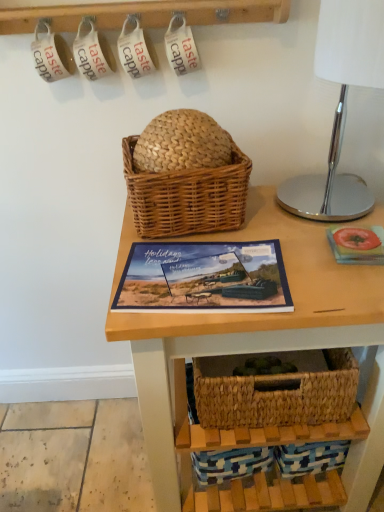
What is the approximate width of woven brown picnic basket at center?

woven brown picnic basket at center is 9.98 inches wide.

Locate an element on the screen. woven wood table at center is located at coordinates (244, 321).

Describe the element at coordinates (204, 278) in the screenshot. I see `matte blue book at center` at that location.

Image resolution: width=384 pixels, height=512 pixels. Find the location of `polished chrome table lamp at right`. polished chrome table lamp at right is located at coordinates (340, 106).

Identify the location of woven brown picnic basket at center. (187, 196).

Are woven brown picnic basket at center and polished chrome table lamp at right far apart?

No.

From the image's perspective, is woven brown picnic basket at center beneath polished chrome table lamp at right?

Yes, from the image's perspective, woven brown picnic basket at center is below polished chrome table lamp at right.

Considering the relative positions of woven brown picnic basket at center and polished chrome table lamp at right in the image provided, is woven brown picnic basket at center to the left or to the right of polished chrome table lamp at right?

Clearly, woven brown picnic basket at center is on the left of polished chrome table lamp at right in the image.

Considering their positions, is woven brown picnic basket at center located in front of or behind polished chrome table lamp at right?

woven brown picnic basket at center is behind polished chrome table lamp at right.

Would you say woven brown picnic basket at center is a long distance from matte blue book at center?

They are positioned close to each other.

Is woven brown picnic basket at center completely or partially outside of matte blue book at center?

woven brown picnic basket at center lies outside matte blue book at center's area.

Considering the relative sizes of woven brown picnic basket at center and matte blue book at center in the image provided, is woven brown picnic basket at center bigger than matte blue book at center?

Correct, woven brown picnic basket at center is larger in size than matte blue book at center.

Is woven brown picnic basket at center at the left side of matte blue book at center?

Correct, you'll find woven brown picnic basket at center to the left of matte blue book at center.

Is woven wood table at center directly adjacent to matte blue book at center?

No, woven wood table at center is not touching matte blue book at center.

From a real-world perspective, who is located lower, woven wood table at center or matte blue book at center?

woven wood table at center.

Considering the sizes of objects woven wood table at center and matte blue book at center in the image provided, who is wider, woven wood table at center or matte blue book at center?

Wider between the two is woven wood table at center.

Considering the sizes of objects polished chrome table lamp at right and woven brown picnic basket at center in the image provided, who is shorter, polished chrome table lamp at right or woven brown picnic basket at center?

With less height is woven brown picnic basket at center.

Looking at this image, is woven brown picnic basket at center at the back of polished chrome table lamp at right?

That's not correct — polished chrome table lamp at right is not looking away from woven brown picnic basket at center.

From a real-world perspective, is polished chrome table lamp at right located beneath woven brown picnic basket at center?

No.

Where is `table lamp lying above the woven brown picnic basket at center (from the image's perspective)`? table lamp lying above the woven brown picnic basket at center (from the image's perspective) is located at coordinates (340, 106).

Consider the image. Considering the relative positions of matte blue book at center and woven wood table at center in the image provided, is matte blue book at center to the right of woven wood table at center from the viewer's perspective?

No, matte blue book at center is not to the right of woven wood table at center.

Is woven wood table at center at the back of matte blue book at center?

Yes, matte blue book at center is positioned with its back facing woven wood table at center.

From a real-world perspective, which object stands above the other?

matte blue book at center is physically above.

Does matte blue book at center have a smaller size compared to woven wood table at center?

Yes.

Where is `table that appears below the polished chrome table lamp at right (from the image's perspective)`? This screenshot has width=384, height=512. table that appears below the polished chrome table lamp at right (from the image's perspective) is located at coordinates (244, 321).

Is woven wood table at center placed right next to polished chrome table lamp at right?

woven wood table at center is not next to polished chrome table lamp at right, and they're not touching.

Is point (141, 335) closer or farther from the camera than point (279, 188)?

Point (141, 335) is closer to the camera than point (279, 188).

Does woven brown picnic basket at center appear on the left side of woven wood table at center?

Indeed, woven brown picnic basket at center is positioned on the left side of woven wood table at center.

Is woven brown picnic basket at center oriented away from woven wood table at center?

That's not correct — woven brown picnic basket at center is not looking away from woven wood table at center.

Looking at the image, does woven brown picnic basket at center seem bigger or smaller compared to woven wood table at center?

Clearly, woven brown picnic basket at center is smaller in size than woven wood table at center.

How much distance is there between woven brown picnic basket at center and woven wood table at center?

woven brown picnic basket at center and woven wood table at center are 8.52 inches apart.

Find the location of a particular element. table lamp that is in front of the woven brown picnic basket at center is located at coordinates (340, 106).

What are the coordinates of `picnic basket that appears above the matte blue book at center (from the image's perspective)` in the screenshot? It's located at (187, 196).

Considering their positions, is matte blue book at center positioned closer to polished chrome table lamp at right than woven brown picnic basket at center?

The object closer to polished chrome table lamp at right is woven brown picnic basket at center.

Estimate the real-world distances between objects in this image. Which object is further from woven brown picnic basket at center, woven wood table at center or polished chrome table lamp at right?

polished chrome table lamp at right lies further to woven brown picnic basket at center than the other object.

Estimate the real-world distances between objects in this image. Which object is closer to matte blue book at center, polished chrome table lamp at right or woven brown picnic basket at center?

woven brown picnic basket at center is closer to matte blue book at center.

Looking at the image, which one is located closer to matte blue book at center, woven wood table at center or woven brown picnic basket at center?

woven brown picnic basket at center lies closer to matte blue book at center than the other object.

When comparing their distances from woven brown picnic basket at center, does polished chrome table lamp at right or woven wood table at center seem further?

Among the two, polished chrome table lamp at right is located further to woven brown picnic basket at center.

Looking at this image, which object lies further to the anchor point woven wood table at center, polished chrome table lamp at right or woven brown picnic basket at center?

polished chrome table lamp at right.

Looking at the image, which one is located further to woven wood table at center, matte blue book at center or polished chrome table lamp at right?

polished chrome table lamp at right is further to woven wood table at center.

Considering their positions, is woven wood table at center positioned further to woven brown picnic basket at center than matte blue book at center?

woven wood table at center lies further to woven brown picnic basket at center than the other object.

Find the location of a particular element. Image resolution: width=384 pixels, height=512 pixels. picture frame between woven brown picnic basket at center and polished chrome table lamp at right in the horizontal direction is located at coordinates (204, 278).

The height and width of the screenshot is (512, 384). In order to click on picnic basket between polished chrome table lamp at right and woven wood table at center in the vertical direction in this screenshot , I will do `click(187, 196)`.

Find the location of a particular element. Image resolution: width=384 pixels, height=512 pixels. picture frame between woven brown picnic basket at center and woven wood table at center from top to bottom is located at coordinates (204, 278).

The width and height of the screenshot is (384, 512). I want to click on picture frame between polished chrome table lamp at right and woven wood table at center vertically, so click(x=204, y=278).